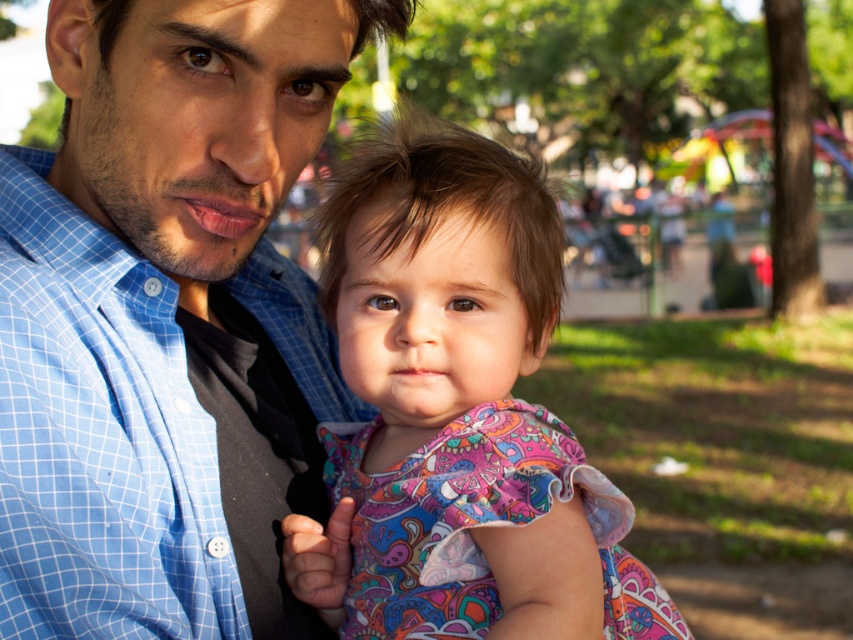
Between blue checkered shirt at center and blue checkered shirt at left, which one is positioned lower?

blue checkered shirt at left

Does blue checkered shirt at center have a greater width compared to blue checkered shirt at left?

Yes.

Measure the distance between point [126,195] and camera.

Point [126,195] is 3.89 feet away from camera.

Where is `blue checkered shirt at center`? This screenshot has width=853, height=640. blue checkered shirt at center is located at coordinates (x=166, y=320).

Does blue checkered shirt at center have a greater width compared to paisley fabric dress at center?

In fact, blue checkered shirt at center might be narrower than paisley fabric dress at center.

Can you confirm if blue checkered shirt at center is shorter than paisley fabric dress at center?

No, blue checkered shirt at center is not shorter than paisley fabric dress at center.

I want to click on blue checkered shirt at center, so click(166, 320).

Is paisley fabric dress at center positioned before blue checkered shirt at left?

No, it is not.

Does paisley fabric dress at center appear on the right side of blue checkered shirt at left?

Indeed, paisley fabric dress at center is positioned on the right side of blue checkered shirt at left.

Find the location of a particular element. This screenshot has height=640, width=853. paisley fabric dress at center is located at coordinates (457, 413).